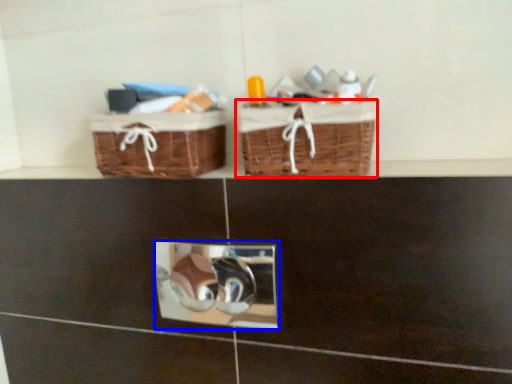
Question: Which point is closer to the camera, picnic basket (highlighted by a red box) or mirror (highlighted by a blue box)?

Choices:
 (A) picnic basket
 (B) mirror

Answer: (A)